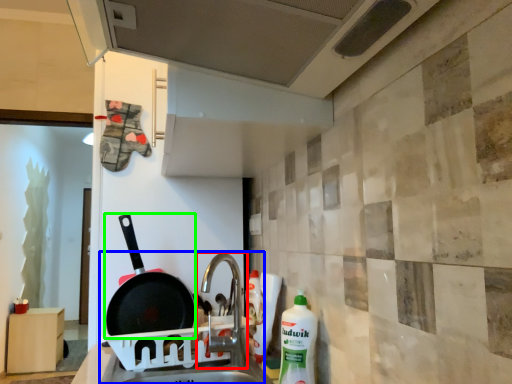
Question: Which is farther away from tap (highlighted by a red box)? sink (highlighted by a blue box) or frying pan (highlighted by a green box)?

Choices:
 (A) sink
 (B) frying pan

Answer: (B)